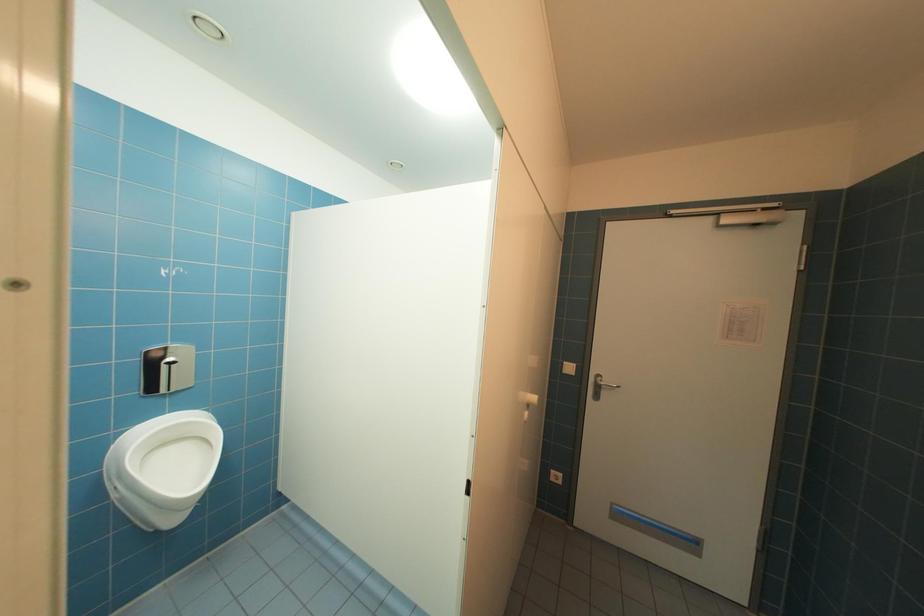
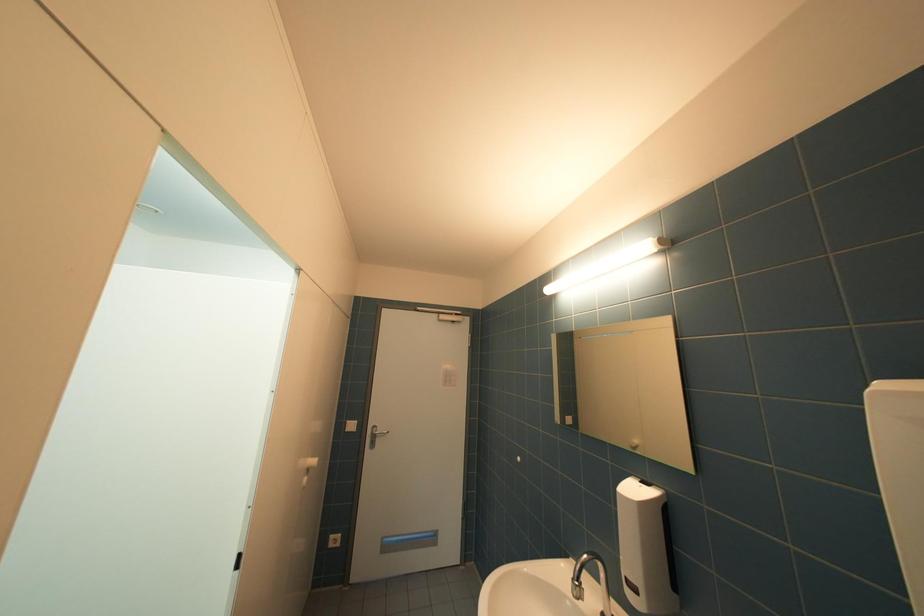
Question: How did the camera likely rotate?

Choices:
 (A) Left
 (B) Right
 (C) Up
 (D) Down

Answer: (B)